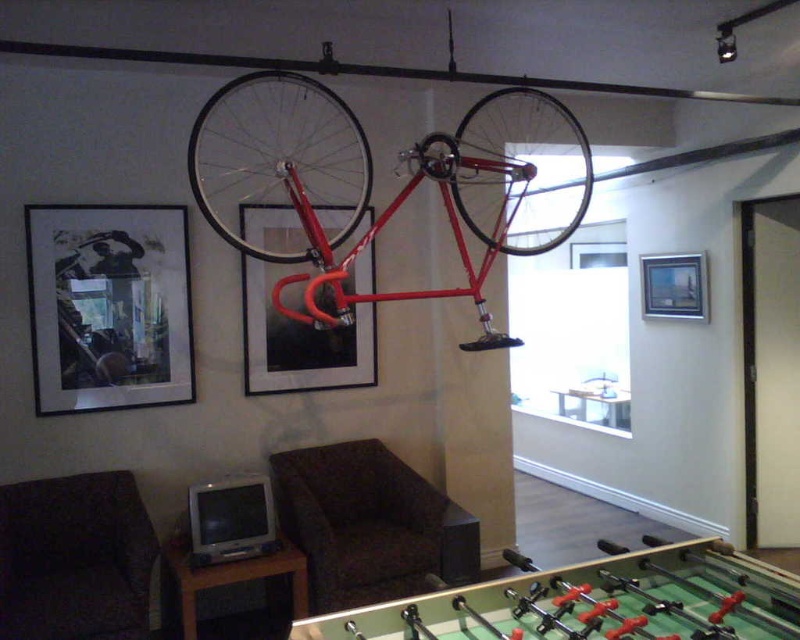
You are an interior designer assessing the wall layout. Which picture frame is positioned lower on the wall, the matte black picture frame at upper left or the wooden picture frame at upper right?

The matte black picture frame at upper left is positioned lower on the wall than the wooden picture frame at upper right.

Please look at the image. There is a point at coordinate (108,307). What object is located at that point?

The point at coordinate (108,307) indicates the matte black picture frame at upper left.

You are standing in the room and want to take a closer look at the matte black picture frame at upper left. Considering your height is 1.7 meters, can you reach it without any assistance?

The matte black picture frame at upper left is 3.49 meters from the camera, which is much higher than your height of 1.7 meters. You will need a ladder or some assistance to reach it.